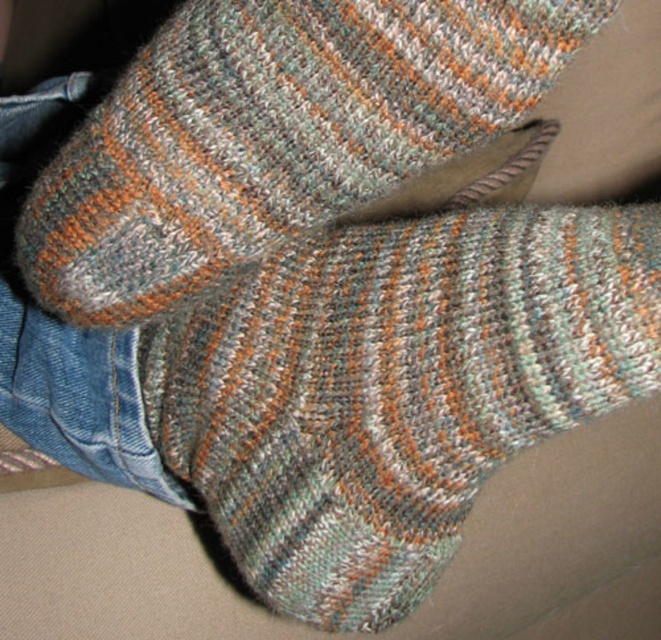
Question: Where is multicolored knitted sock at lower center located in relation to multicolored knitted sock at center in the image?

Choices:
 (A) right
 (B) left

Answer: (A)

Question: Does multicolored knitted sock at lower center appear over multicolored knitted sock at center?

Choices:
 (A) yes
 (B) no

Answer: (B)

Question: Among these points, which one is nearest to the camera?

Choices:
 (A) (514, 246)
 (B) (141, 202)

Answer: (B)

Question: Can you confirm if multicolored knitted sock at lower center is wider than multicolored knitted sock at center?

Choices:
 (A) yes
 (B) no

Answer: (A)